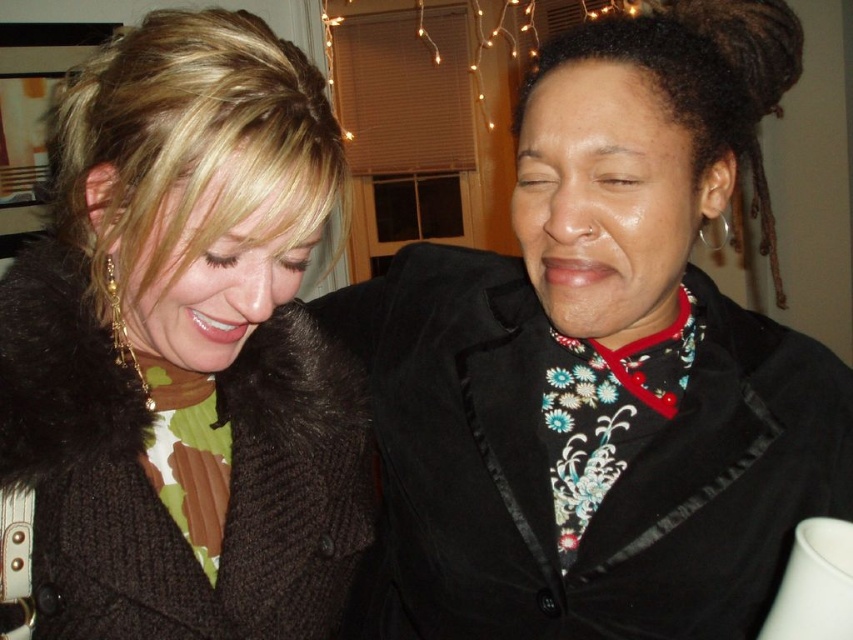
Is velvet black blazer at center positioned in front of brown fuzzy coat at left?

No.

Is velvet black blazer at center thinner than brown fuzzy coat at left?

Incorrect, velvet black blazer at center's width is not less than brown fuzzy coat at left's.

What are the coordinates of `velvet black blazer at center` in the screenshot? It's located at (601, 371).